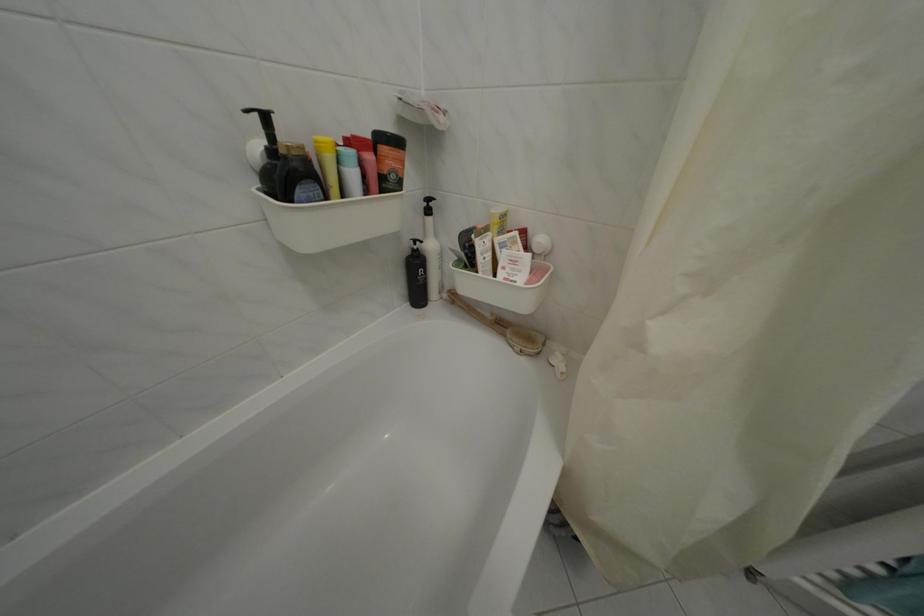
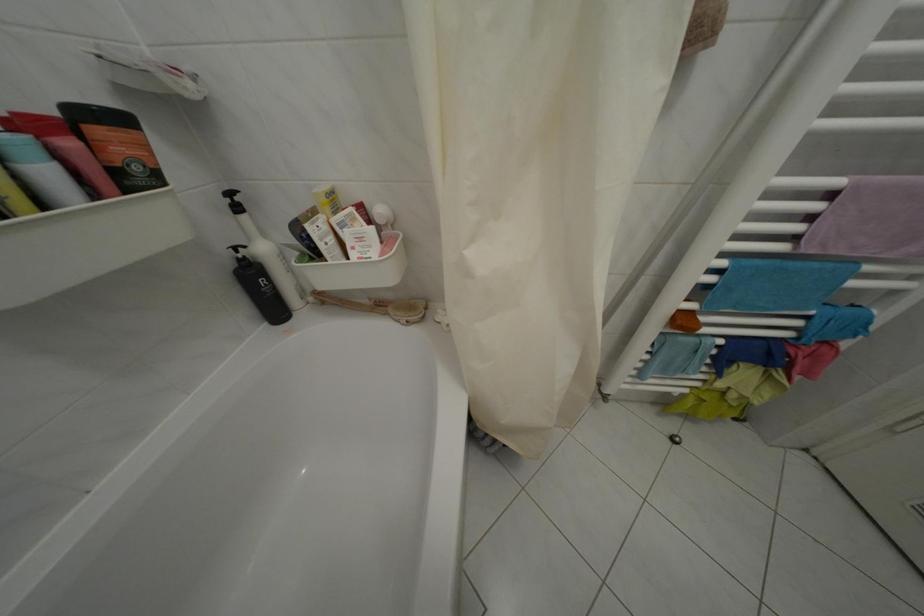
The point at (x=505, y=227) is marked in the first image. Where is the corresponding point in the second image?

(334, 206)